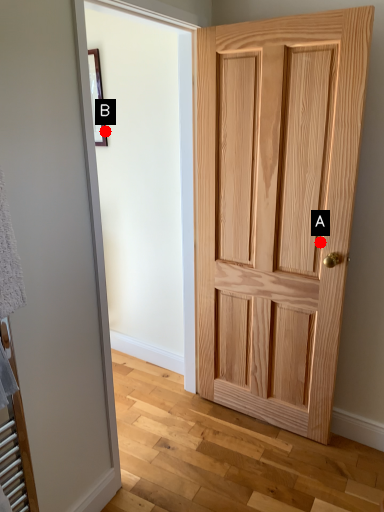
Question: Two points are circled on the image, labeled by A and B beside each circle. Which point is farther to the camera?

Choices:
 (A) A is further
 (B) B is further

Answer: (B)